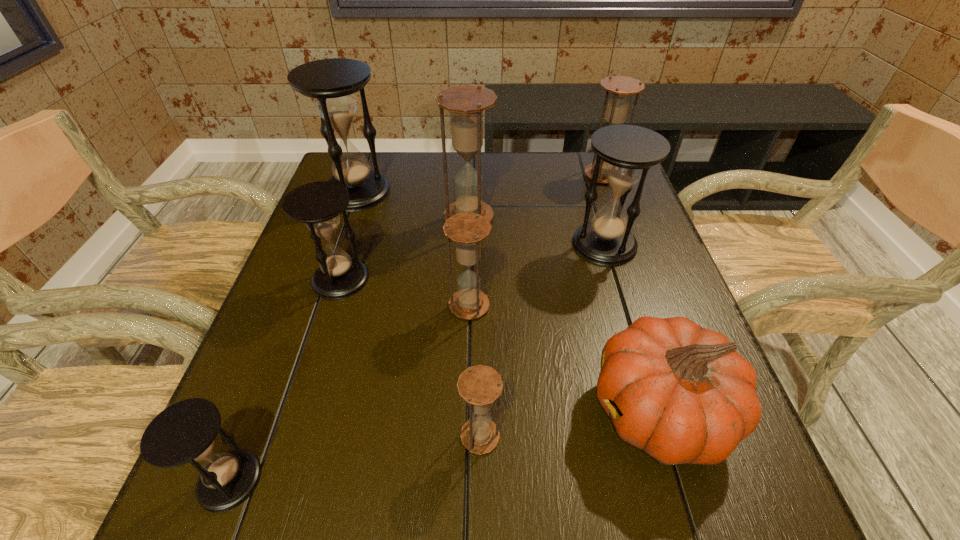
Image resolution: width=960 pixels, height=540 pixels. In order to click on vacant region located on the back of the nearest black hourglass in this screenshot , I will do `click(302, 292)`.

The height and width of the screenshot is (540, 960). I want to click on pumpkin located in the near edge section of the desktop, so click(x=681, y=393).

The image size is (960, 540). What are the coordinates of `hourglass at the near edge` in the screenshot? It's located at (185, 432).

Where is `pumpkin positioned at the right edge`? The image size is (960, 540). pumpkin positioned at the right edge is located at coordinates (681, 393).

Where is `object located in the far left corner section of the desktop`? This screenshot has width=960, height=540. object located in the far left corner section of the desktop is located at coordinates (332, 82).

Image resolution: width=960 pixels, height=540 pixels. I want to click on object located in the near left corner section of the desktop, so click(185, 432).

The width and height of the screenshot is (960, 540). Find the location of `object at the far right corner`. object at the far right corner is located at coordinates (620, 88).

Identify the location of object at the near right corner. (681, 393).

Image resolution: width=960 pixels, height=540 pixels. What are the coordinates of `vacant space at the far edge of the desktop` in the screenshot? It's located at (419, 172).

Locate an element on the screen. The height and width of the screenshot is (540, 960). vacant space at the near edge of the desktop is located at coordinates (483, 471).